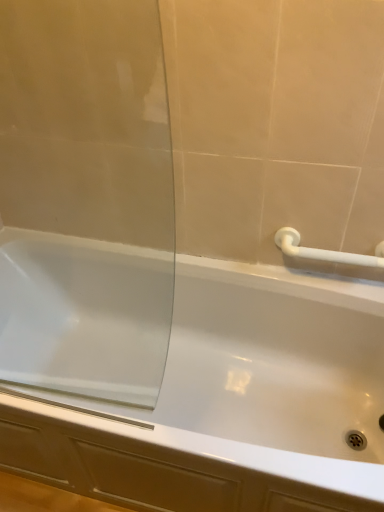
The image size is (384, 512). I want to click on vacant area situated below white plastic towel bar at upper right (from a real-world perspective), so click(x=331, y=282).